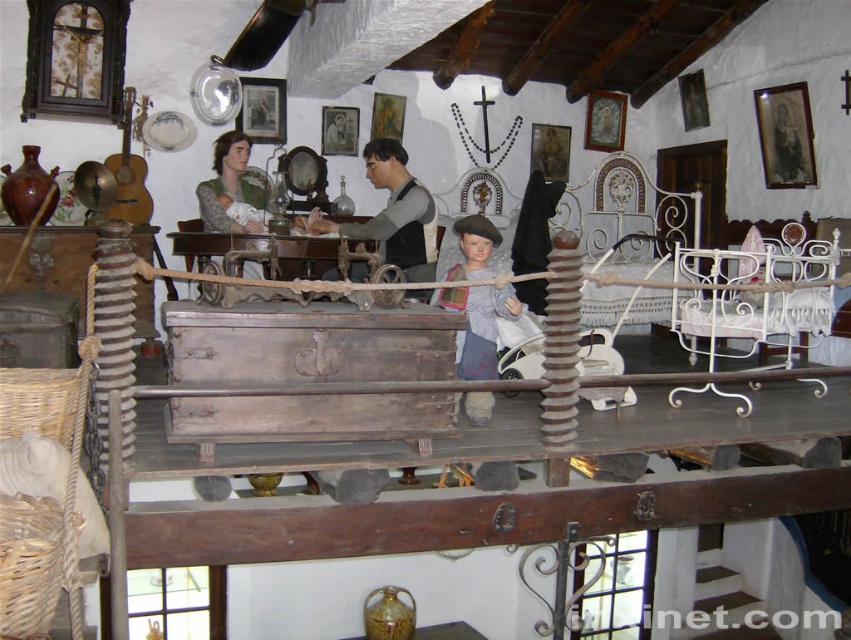
Question: Which point is farther to the camera?

Choices:
 (A) wooden table at center
 (B) matte green fabric doll at center

Answer: (B)

Question: Is wooden table at center wider than matte green fabric doll at center?

Choices:
 (A) no
 (B) yes

Answer: (B)

Question: Can you confirm if wooden chest at center is thinner than wooden table at center?

Choices:
 (A) no
 (B) yes

Answer: (A)

Question: Which object is positioned farthest from the wooden doll at center?

Choices:
 (A) matte green fabric doll at center
 (B) wooden table at center
 (C) wooden chest at center

Answer: (A)

Question: Does smooth gray shirt at center have a lesser width compared to wooden table at center?

Choices:
 (A) yes
 (B) no

Answer: (A)

Question: Considering the real-world distances, which object is farthest from the wooden doll at center?

Choices:
 (A) matte green fabric doll at center
 (B) smooth gray shirt at center
 (C) wooden table at center

Answer: (A)